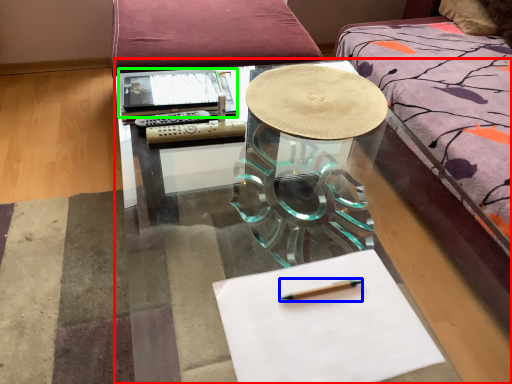
Question: Considering the real-world distances, which object is closest to table (highlighted by a red box)? pencil (highlighted by a blue box) or notebook (highlighted by a green box).

Choices:
 (A) pencil
 (B) notebook

Answer: (B)